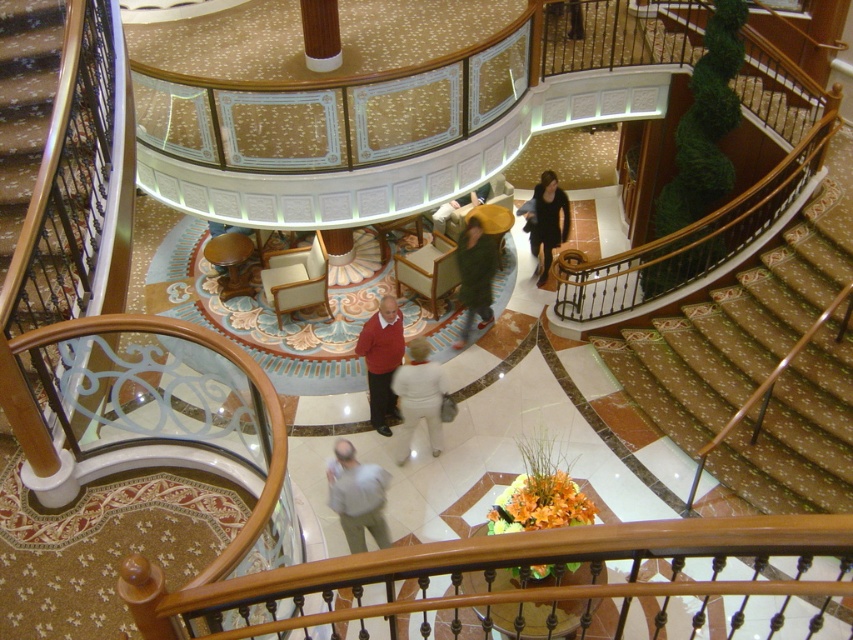
You are standing in the grand atrium and notice a person wearing a light gray fabric shirt at center and white fabric pants at center. From the perspective of someone facing the person, which clothing item is on the left side?

The light gray fabric shirt at center is positioned on the left side of white fabric pants at center.

You are a guest at this luxurious venue and want to ensure your outfit fits comfortably in the central atrium. Given that the light gray fabric shirt at center and white fabric pants at center are part of your attire, which item has a greater width?

The light gray fabric shirt at center has a greater width than the white fabric pants at center.